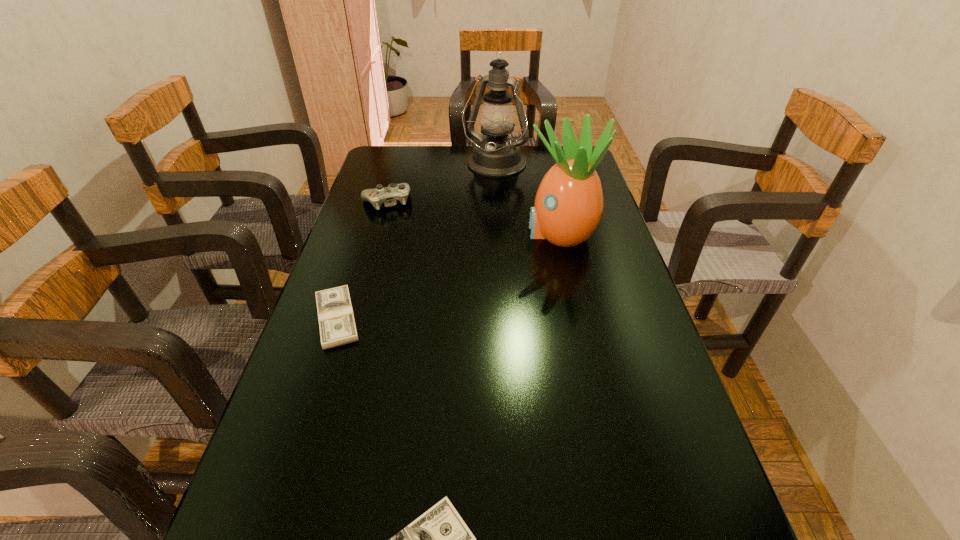
The height and width of the screenshot is (540, 960). Identify the location of vacant area situated 0.310m on the right of the left dollar. (499, 319).

This screenshot has height=540, width=960. I want to click on object located in the far edge section of the desktop, so [x=496, y=155].

Find the location of a particular element. Image resolution: width=960 pixels, height=540 pixels. control present at the left edge is located at coordinates (388, 195).

The image size is (960, 540). Find the location of `dollar present at the left edge`. dollar present at the left edge is located at coordinates (336, 319).

Image resolution: width=960 pixels, height=540 pixels. I want to click on object present at the right edge, so click(569, 203).

Image resolution: width=960 pixels, height=540 pixels. I want to click on free space at the far edge of the desktop, so click(x=539, y=157).

In the image, there is a desktop. What are the coordinates of `vacant space at the left edge` in the screenshot? It's located at (376, 326).

The width and height of the screenshot is (960, 540). Find the location of `free space at the right edge`. free space at the right edge is located at coordinates click(652, 347).

In the image, there is a desktop. Where is `vacant space at the far left corner`? Image resolution: width=960 pixels, height=540 pixels. vacant space at the far left corner is located at coordinates (402, 163).

What are the coordinates of `vacant space that's between the farthest object and the pineapple` in the screenshot? It's located at (527, 199).